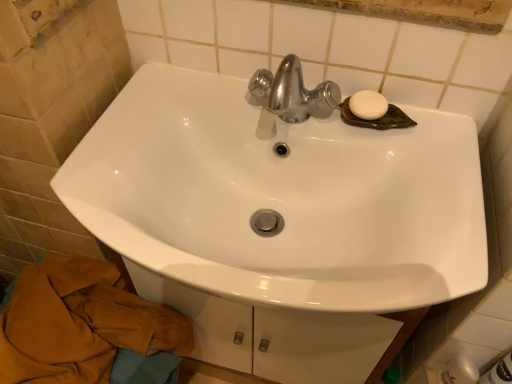
Where is `vacant point to the left of white matte soap at upper right`? vacant point to the left of white matte soap at upper right is located at coordinates (284, 113).